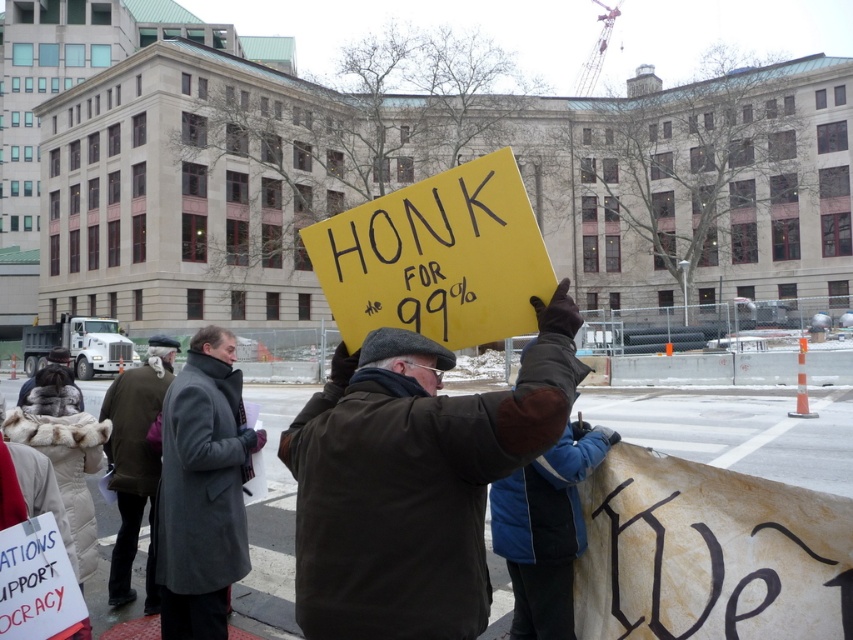
Which of these two, yellow paper sign at center or dark brown wool coat at center, stands taller?

dark brown wool coat at center

Does yellow paper sign at center have a greater height compared to dark brown wool coat at center?

No.

Is point (502, 177) in front of point (117, 490)?

That is True.

The width and height of the screenshot is (853, 640). What are the coordinates of `yellow paper sign at center` in the screenshot? It's located at (436, 257).

Does dark brown leather jacket at center lie behind yellow paper sign at center?

No.

Does dark brown leather jacket at center have a larger size compared to yellow paper sign at center?

No.

Does point (476, 552) come farther from viewer compared to point (519, 173)?

No, it is not.

Image resolution: width=853 pixels, height=640 pixels. Find the location of `dark brown leather jacket at center`. dark brown leather jacket at center is located at coordinates (413, 480).

Image resolution: width=853 pixels, height=640 pixels. What do you see at coordinates (413, 480) in the screenshot?
I see `dark brown leather jacket at center` at bounding box center [413, 480].

Does dark brown leather jacket at center have a smaller size compared to dark brown wool coat at center?

Indeed, dark brown leather jacket at center has a smaller size compared to dark brown wool coat at center.

Locate an element on the screen. This screenshot has width=853, height=640. dark brown leather jacket at center is located at coordinates (413, 480).